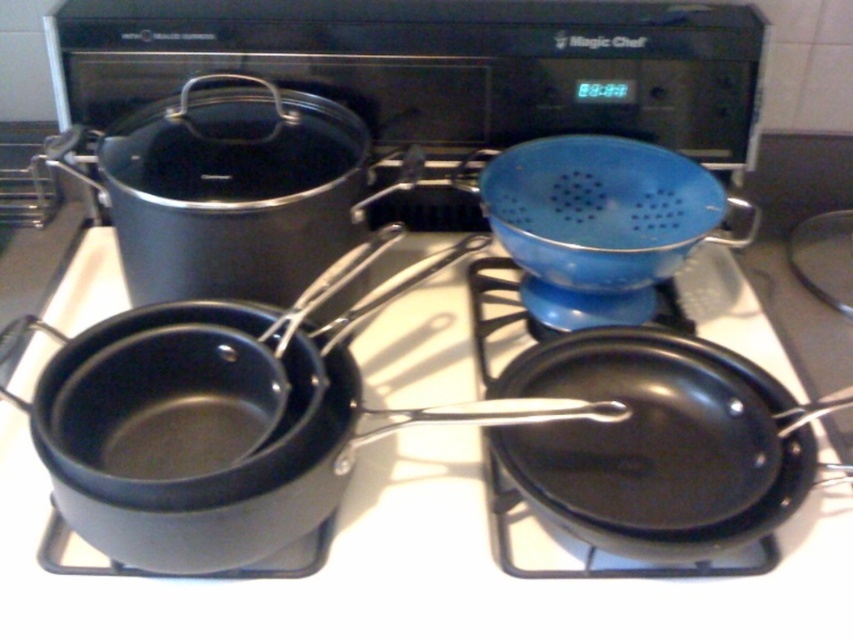
Between black non-stick frying pan at lower right and black matte frying pan at lower right, which one has less height?

Standing shorter between the two is black matte frying pan at lower right.

Is black non-stick frying pan at lower right positioned at the back of black matte frying pan at lower right?

No.

Which is in front, point (309, 358) or point (577, 500)?

Point (577, 500) is more forward.

Locate an element on the screen. black non-stick frying pan at lower right is located at coordinates (192, 435).